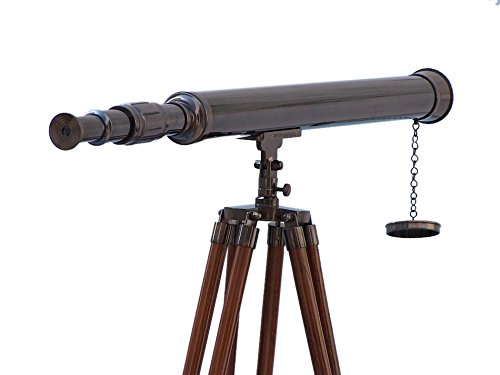
Identify the location of wooden legs. This screenshot has width=500, height=375. (224, 343).